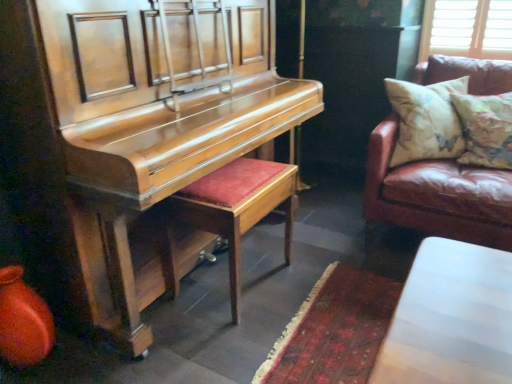
Question: From the image's perspective, relative to floral fabric cushion at right, is brown leather couch at right above or below?

Choices:
 (A) below
 (B) above

Answer: (B)

Question: Is point (281, 33) positioned closer to the camera than point (484, 162)?

Choices:
 (A) closer
 (B) farther

Answer: (B)

Question: Estimate the real-world distances between objects in this image. Which object is farther from the leather couch at right?

Choices:
 (A) shiny wood harpsichord at left
 (B) floral fabric cushion at right
 (C) velvet red stool at center
 (D) brown leather couch at right

Answer: (D)

Question: Based on their relative distances, which object is nearer to the floral fabric cushion at right?

Choices:
 (A) shiny wood harpsichord at left
 (B) brown leather couch at right
 (C) leather couch at right
 (D) velvet red stool at center

Answer: (C)